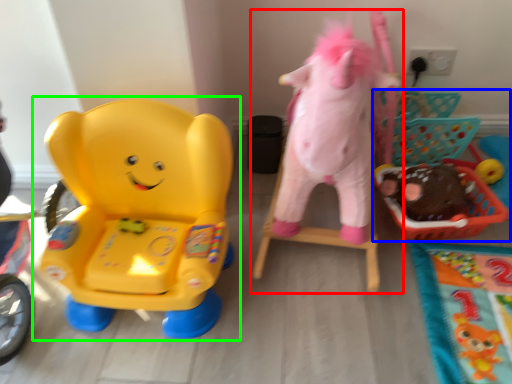
Question: Based on their relative distances, which object is nearer to toy (highlighted by a red box)? Choose from toy (highlighted by a blue box) and toy (highlighted by a green box).

Choices:
 (A) toy
 (B) toy

Answer: (A)